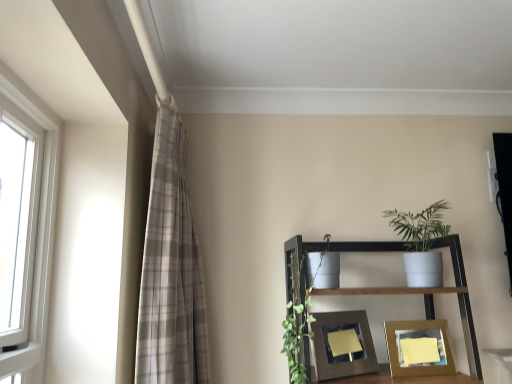
You are a GUI agent. You are given a task and a screenshot of the screen. Output one action in this format:
    pyautogui.click(x=<x>, y=<y>)
    Task: Click on the free space above white plastic window at left (from a real-world perspective)
    The image size is (512, 384).
    Given the screenshot: What is the action you would take?
    (x=27, y=93)